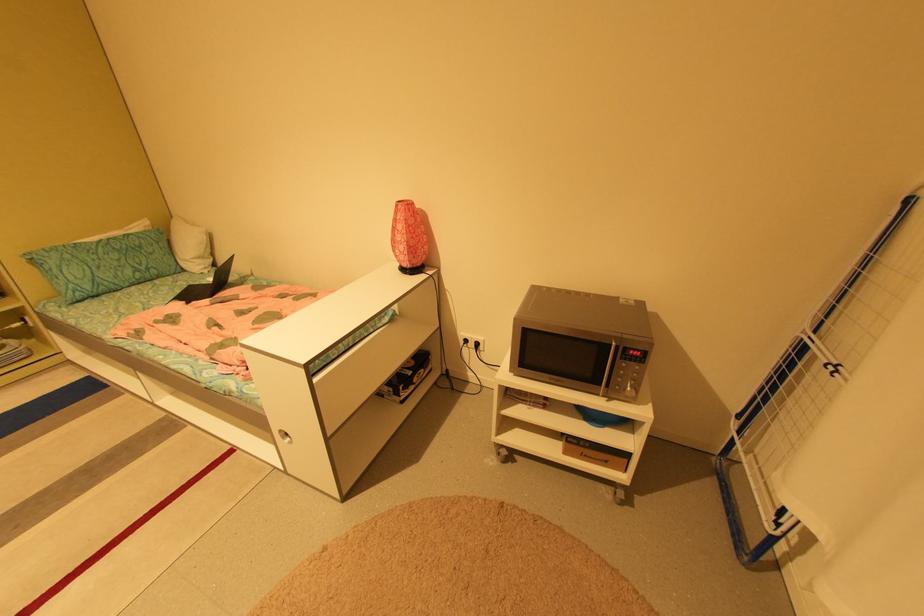
Where would you lift the green patterned pillow? Please return your answer as a coordinate pair (x, y).

(103, 264)